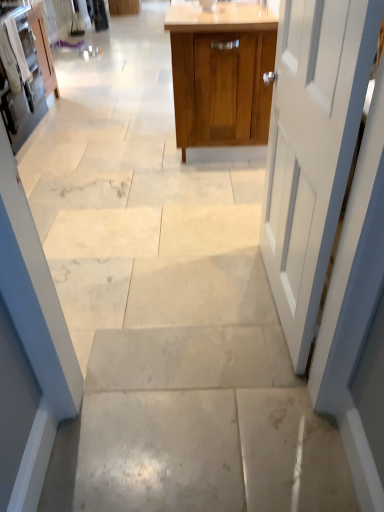
The height and width of the screenshot is (512, 384). What are the coordinates of `empty space that is in between matte white cabinet at left, which is counted as the second cabinetry, starting from the right, and wooden cabinet at center, which ranks as the 1th cabinetry in right-to-left order` in the screenshot? It's located at (108, 126).